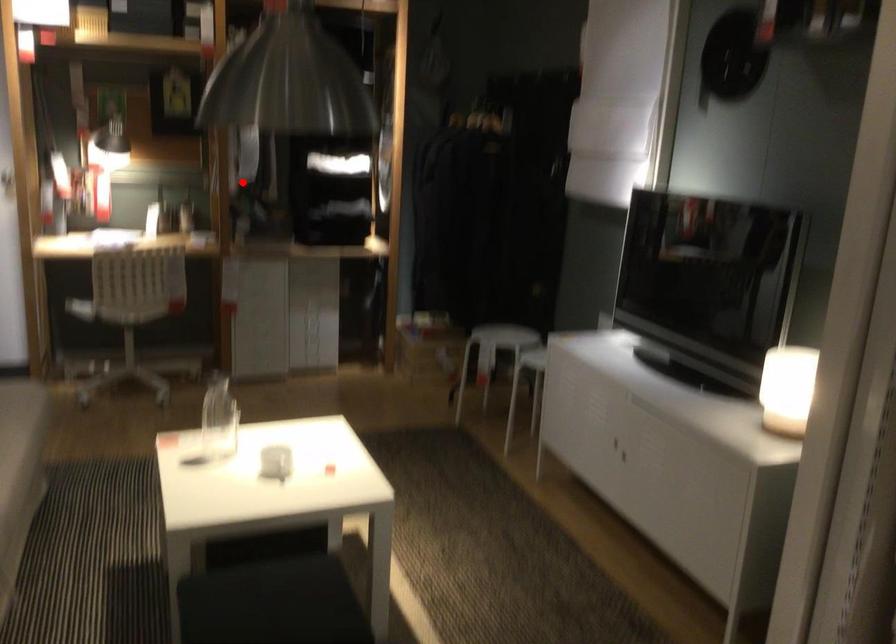
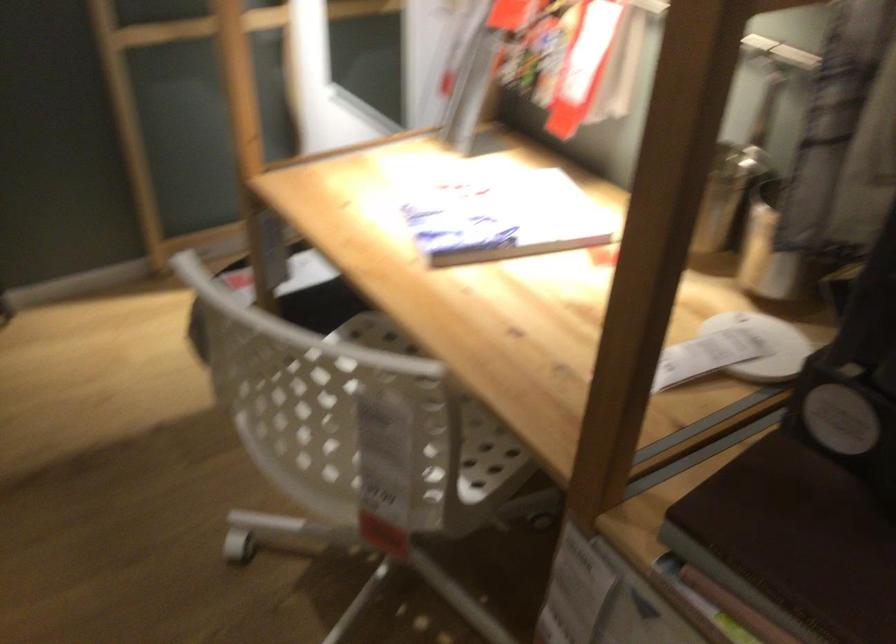
Question: A red point is marked in image1. In image2, is the corresponding 3D point closer to the camera or farther? Reply with the corresponding letter.

Choices:
 (A) The corresponding 3D point is closer.
 (B) The corresponding 3D point is farther.

Answer: (A)